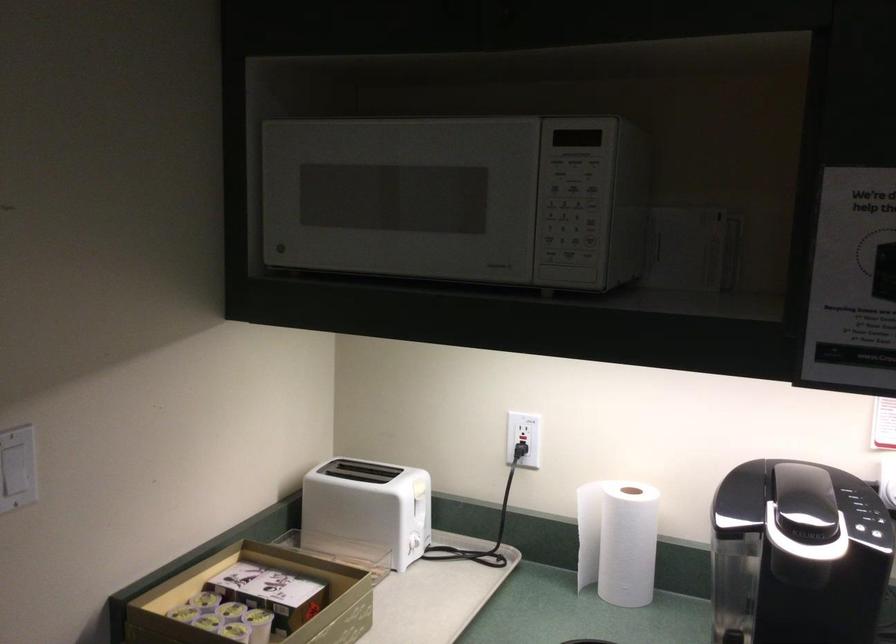
Where would you push the microwave door button? Please return your answer as a coordinate pair (x, y).

(565, 279)